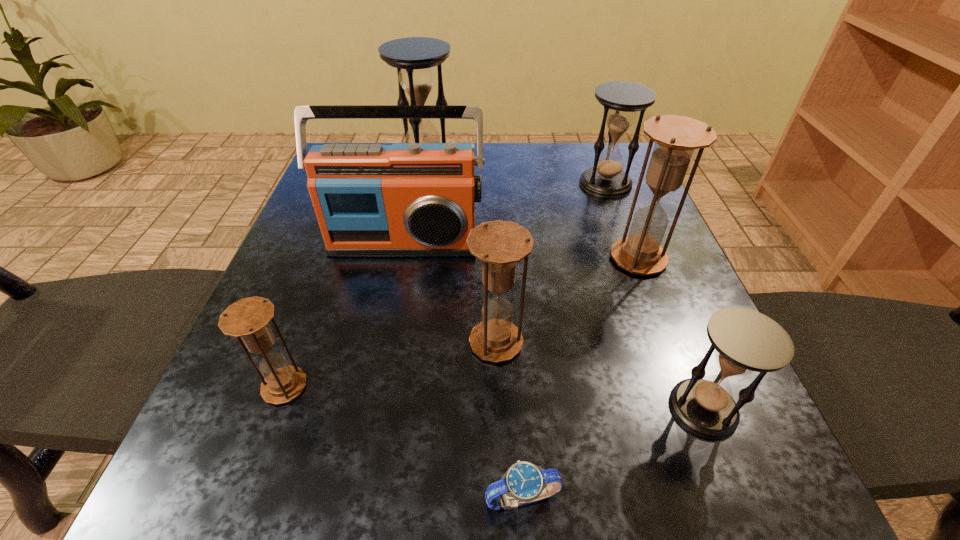
Find the location of a particular element. This screenshot has height=540, width=960. the leftmost black hourglass is located at coordinates (414, 57).

The height and width of the screenshot is (540, 960). In order to click on the biggest black hourglass in this screenshot , I will do `click(414, 57)`.

Find the location of `the farthest brown hourglass`. the farthest brown hourglass is located at coordinates (676, 137).

I want to click on the rightmost brown hourglass, so click(676, 137).

Identify the location of blue radio receiver. This screenshot has height=540, width=960. (406, 199).

The width and height of the screenshot is (960, 540). What are the coordinates of `the second biggest black hourglass` in the screenshot? It's located at (606, 179).

Where is `the fifth farthest object`? the fifth farthest object is located at coordinates (499, 244).

Identify the location of the second smallest brown hourglass. (499, 244).

Where is `the smallest brown hourglass`? Image resolution: width=960 pixels, height=540 pixels. the smallest brown hourglass is located at coordinates (248, 318).

At what (x,y) coordinates should I click in order to perform the action: click on the leftmost brown hourglass. Please return your answer as a coordinate pair (x, y). Looking at the image, I should click on (248, 318).